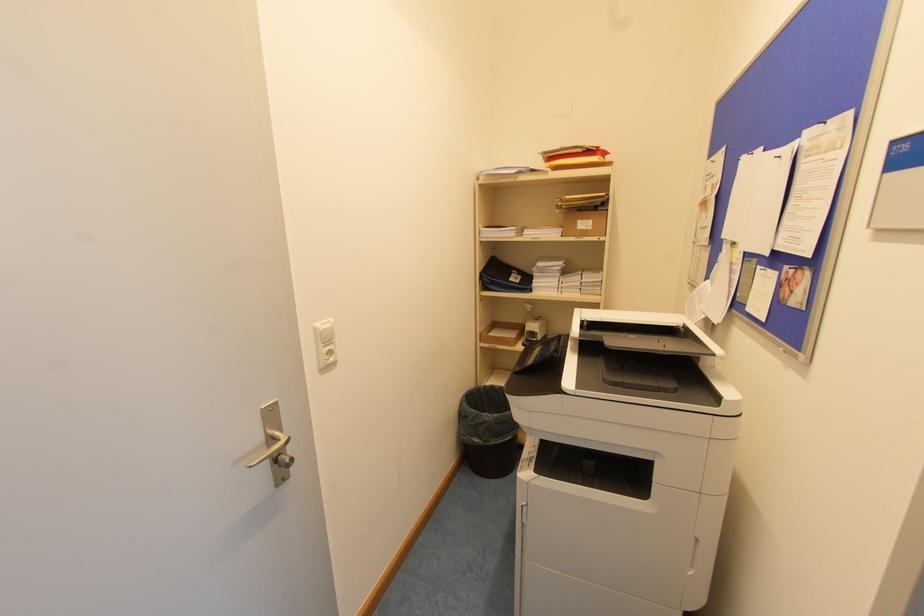
Identify the location of printer drawer handle. Image resolution: width=924 pixels, height=616 pixels. (520, 516).